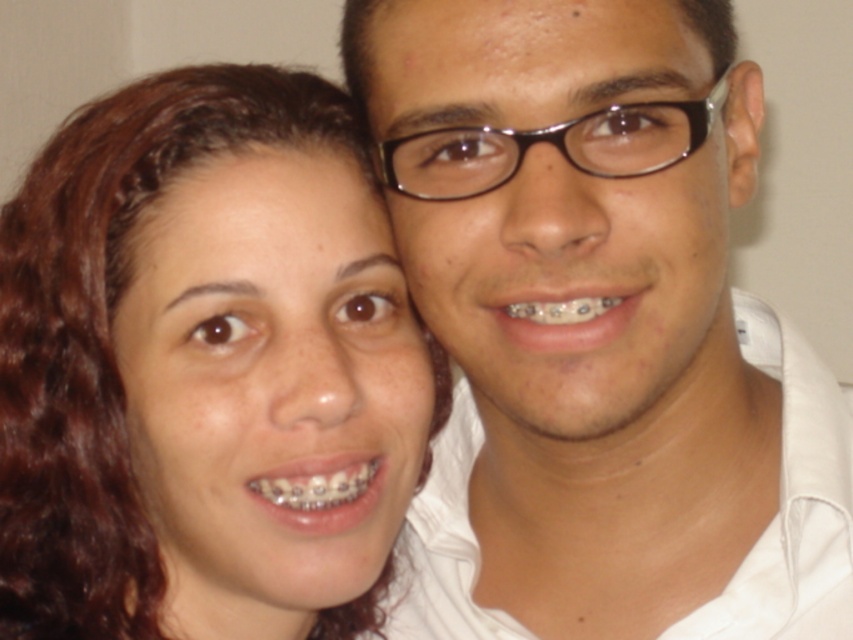
You are a photographer adjusting the lighting for a portrait. You notice the matte skin at center and the metallic braces at lower center. Which object should you focus on to ensure proper exposure since it reflects more light?

The metallic braces at lower center reflect more light than the matte skin at center, so you should focus on the metallic braces at lower center to ensure proper exposure.

You are a dentist examining two sets of braces in the photo. The metallic braces at center and the metallic braces at lower center. Which set has a greater width?

The metallic braces at center has a greater width than the metallic braces at lower center.

You are a dentist examining two sets of metallic braces in the photo. Which set of metallic braces at center or metallic braces at lower center is closer to you?

The metallic braces at center is closer to the viewer than metallic braces at lower center.